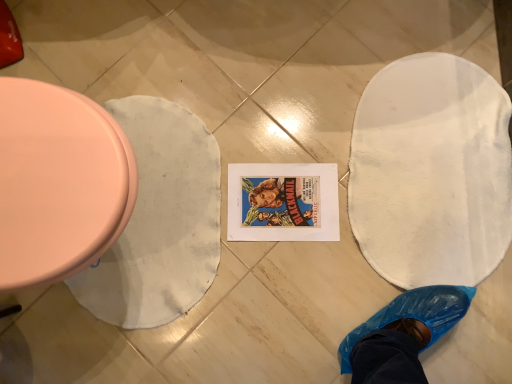
I want to click on free point behind white fabric blanket at left, so click(x=163, y=48).